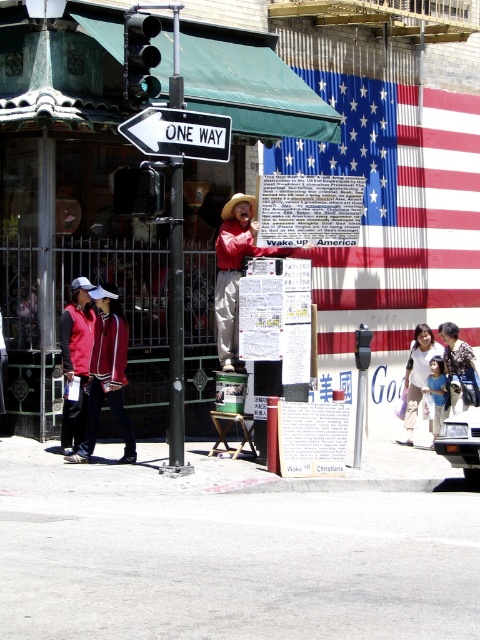
Question: Can you confirm if blue corrugated metal flag at upper center is positioned to the right of floral fabric dress at center?

Choices:
 (A) no
 (B) yes

Answer: (A)

Question: Can you confirm if blue corrugated metal flag at upper center is smaller than green glass traffic light at upper left?

Choices:
 (A) no
 (B) yes

Answer: (A)

Question: Which of the following is the farthest from the observer?

Choices:
 (A) (63, 394)
 (B) (453, 353)

Answer: (B)

Question: Among these points, which one is nearest to the camera?

Choices:
 (A) (262, 253)
 (B) (422, 307)

Answer: (A)

Question: Is blue corrugated metal flag at upper center bigger than red jacket at lower left?

Choices:
 (A) no
 (B) yes

Answer: (B)

Question: Which point is closer to the camera taking this photo?

Choices:
 (A) (431, 337)
 (B) (146, 84)
 (C) (393, 147)

Answer: (B)